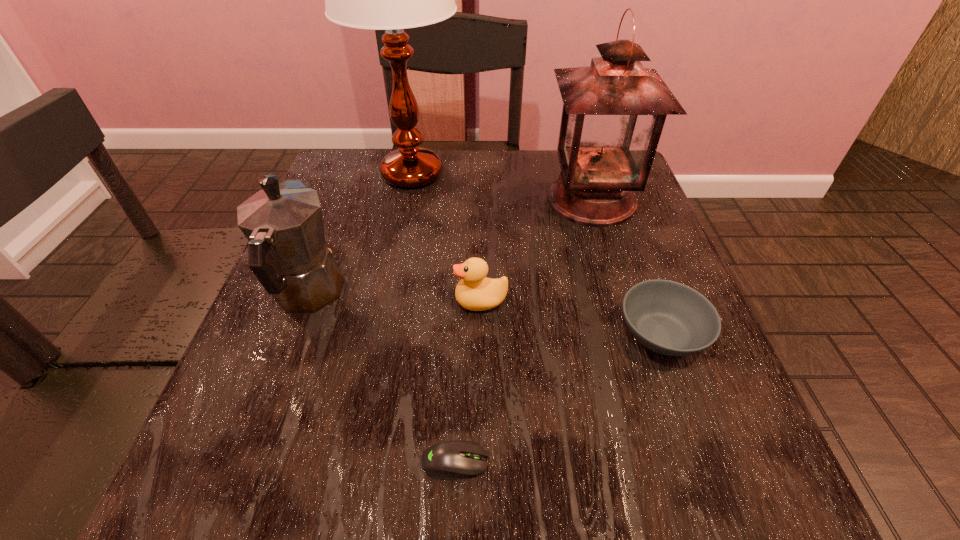
Locate an element on the screen. table lamp is located at coordinates (392, 0).

Where is `oil lamp`? oil lamp is located at coordinates (614, 111).

Where is `coffeepot`? The image size is (960, 540). coffeepot is located at coordinates (283, 223).

I want to click on the third shortest object, so click(476, 292).

Locate an element on the screen. The image size is (960, 540). soup bowl is located at coordinates (x=669, y=318).

Identify the location of the nearest object. The width and height of the screenshot is (960, 540). (451, 460).

Locate an element on the screen. This screenshot has width=960, height=540. the shortest object is located at coordinates (451, 460).

Where is `vacant space located on the right of the tallest object`? The image size is (960, 540). vacant space located on the right of the tallest object is located at coordinates (516, 174).

In order to click on vacant space situated 0.090m on the back of the oil lamp in this screenshot , I will do `click(578, 156)`.

Locate an element on the screen. free space located on the pouring side of the fourth shortest object is located at coordinates (332, 230).